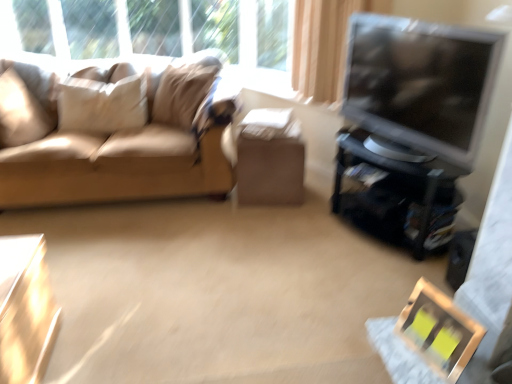
Where is `vacant space situated on the left part of matte black tv stand at right`? The image size is (512, 384). vacant space situated on the left part of matte black tv stand at right is located at coordinates (293, 236).